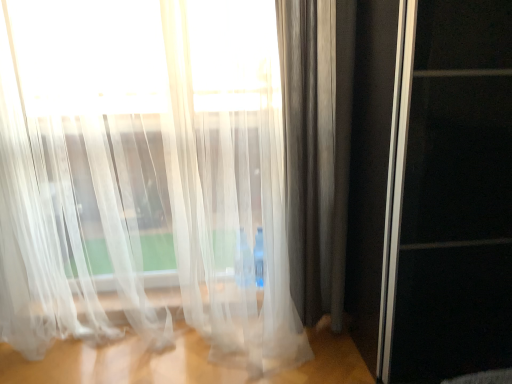
Question: Is translucent white curtain at left, which is the 2th curtain from right to left, inside the boundaries of satin gray curtain at right, placed as the 1th curtain when sorted from right to left, or outside?

Choices:
 (A) inside
 (B) outside

Answer: (B)

Question: Considering the positions of translucent white curtain at left, positioned as the first curtain in left-to-right order, and satin gray curtain at right, placed as the second curtain when sorted from left to right, in the image, is translucent white curtain at left, positioned as the first curtain in left-to-right order, bigger or smaller than satin gray curtain at right, placed as the second curtain when sorted from left to right,?

Choices:
 (A) big
 (B) small

Answer: (A)

Question: Which of these objects is positioned farthest from the satin gray curtain at right, placed as the second curtain when sorted from left to right?

Choices:
 (A) translucent white curtain at left, which is the 2th curtain from right to left
 (B) transparent glass screen door at right

Answer: (B)

Question: Which object is the farthest from the transparent glass screen door at right?

Choices:
 (A) satin gray curtain at right, placed as the 1th curtain when sorted from right to left
 (B) translucent white curtain at left, positioned as the first curtain in left-to-right order

Answer: (B)